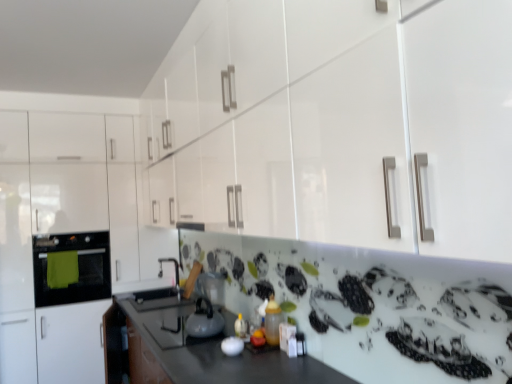
Question: Which direction should I rotate to look at satin silver kettle at center, placed as the 1th appliance when sorted from back to front?

Choices:
 (A) left
 (B) right

Answer: (A)

Question: Is white glossy kettle at center, positioned as the 1th appliance in right-to-left order, thinner than white glossy kettle at center?

Choices:
 (A) yes
 (B) no

Answer: (A)

Question: Does white glossy kettle at center, positioned as the 1th appliance in right-to-left order, appear on the left side of white glossy kettle at center?

Choices:
 (A) yes
 (B) no

Answer: (B)

Question: Would you say white glossy kettle at center, positioned as the first appliance in front-to-back order, is outside white glossy kettle at center?

Choices:
 (A) no
 (B) yes

Answer: (B)

Question: Is white glossy kettle at center, positioned as the first appliance in front-to-back order, further to camera compared to white glossy kettle at center?

Choices:
 (A) yes
 (B) no

Answer: (B)

Question: Does white glossy kettle at center, the 2th appliance from the left, have a smaller size compared to white glossy kettle at center?

Choices:
 (A) yes
 (B) no

Answer: (A)

Question: Can you confirm if white glossy kettle at center, the 2th appliance from the left, is shorter than white glossy kettle at center?

Choices:
 (A) yes
 (B) no

Answer: (A)

Question: Does white glossy cabinet at left have a lesser width compared to matte black oven at left?

Choices:
 (A) no
 (B) yes

Answer: (A)

Question: From a real-world perspective, is white glossy cabinet at left on matte black oven at left?

Choices:
 (A) no
 (B) yes

Answer: (B)

Question: Can you confirm if white glossy cabinet at left is bigger than matte black oven at left?

Choices:
 (A) yes
 (B) no

Answer: (A)

Question: From the image's perspective, is white glossy cabinet at left above matte black oven at left?

Choices:
 (A) no
 (B) yes

Answer: (B)

Question: From a real-world perspective, is white glossy cabinet at left under matte black oven at left?

Choices:
 (A) yes
 (B) no

Answer: (B)

Question: Considering the relative sizes of white glossy cabinet at left and matte black oven at left in the image provided, is white glossy cabinet at left wider than matte black oven at left?

Choices:
 (A) yes
 (B) no

Answer: (A)

Question: Can you confirm if matte black oven at left is thinner than white glossy cabinet at left?

Choices:
 (A) no
 (B) yes

Answer: (B)